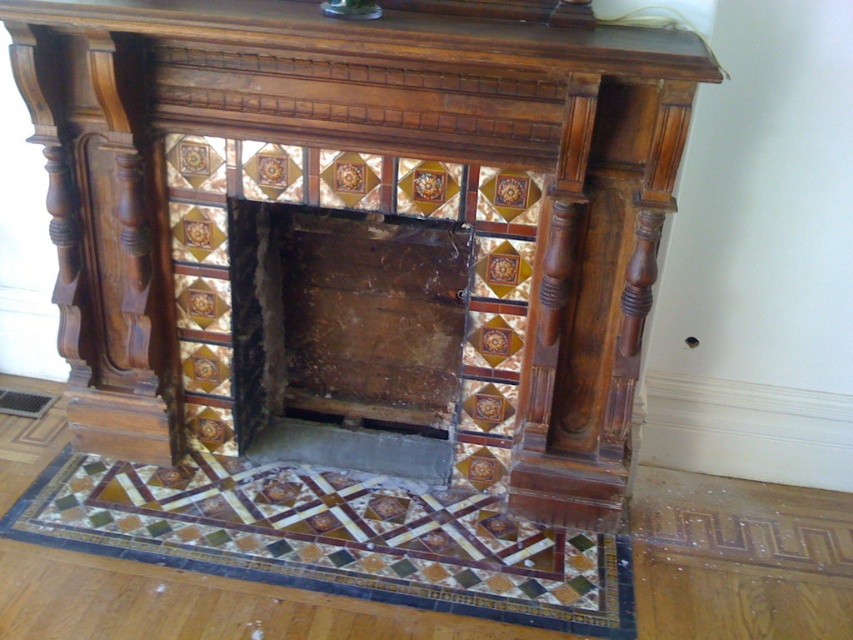
Is polished wood fireplace at center closer to camera compared to rusty wood fireplace at center?

Yes, polished wood fireplace at center is closer to the viewer.

Is point (595, 403) positioned behind point (389, 301)?

No, it is in front of (389, 301).

The image size is (853, 640). In order to click on polished wood fireplace at center in this screenshot , I will do `click(358, 228)`.

Who is positioned more to the right, mosaic tile floor at lower center or rusty wood fireplace at center?

rusty wood fireplace at center is more to the right.

Can you confirm if mosaic tile floor at lower center is taller than rusty wood fireplace at center?

No.

Between point (462, 595) and point (309, 253), which one is positioned in front?

Positioned in front is point (462, 595).

The height and width of the screenshot is (640, 853). I want to click on mosaic tile floor at lower center, so click(334, 540).

Who is shorter, rusty wood fireplace at center or polished wood mantle at upper center?

Standing shorter between the two is polished wood mantle at upper center.

Is rusty wood fireplace at center thinner than polished wood mantle at upper center?

Indeed, rusty wood fireplace at center has a lesser width compared to polished wood mantle at upper center.

Does point (398, 324) come in front of point (444, 1)?

No, it is behind (444, 1).

You are a GUI agent. You are given a task and a screenshot of the screen. Output one action in this format:
    pyautogui.click(x=<x>, y=<y>)
    Task: Click on the rusty wood fireplace at center
    This screenshot has height=640, width=853.
    Given the screenshot: What is the action you would take?
    pyautogui.click(x=346, y=337)